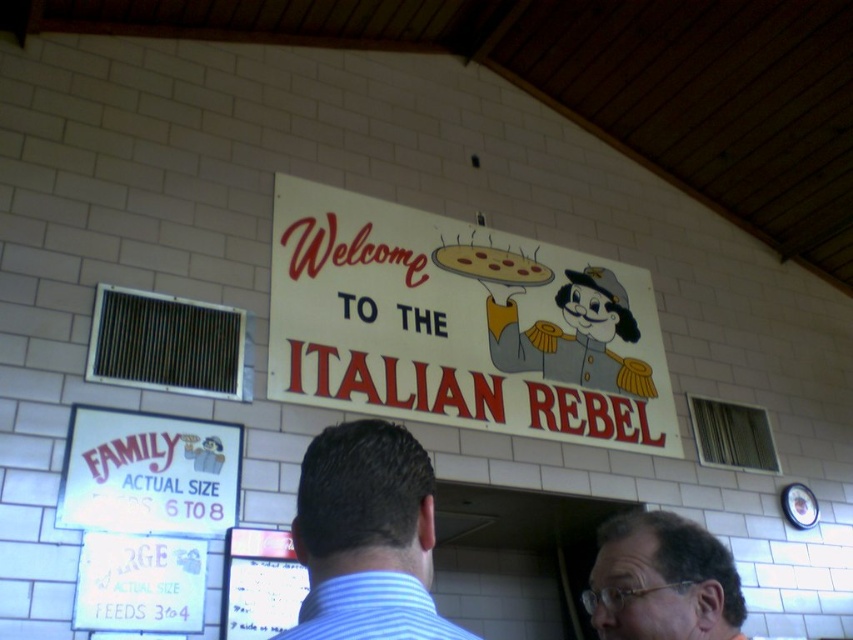
Question: Which is nearer to the blue striped shirt at center?

Choices:
 (A) matte yellow pizza at center
 (B) dark brown hair at center

Answer: (B)

Question: In this image, where is blue striped shirt at center located relative to matte yellow pizza at center?

Choices:
 (A) above
 (B) below

Answer: (B)

Question: Based on their relative distances, which object is nearer to the white cardboard sign at center?

Choices:
 (A) dark brown hair at center
 (B) matte yellow pizza at center

Answer: (B)

Question: Does white cardboard sign at center have a greater width compared to blue striped shirt at center?

Choices:
 (A) yes
 (B) no

Answer: (A)

Question: Can you confirm if blue striped shirt at center is positioned to the right of dark brown hair at center?

Choices:
 (A) yes
 (B) no

Answer: (B)

Question: Which point is farther from the camera taking this photo?

Choices:
 (A) (688, 621)
 (B) (337, 220)
 (C) (488, 273)

Answer: (C)